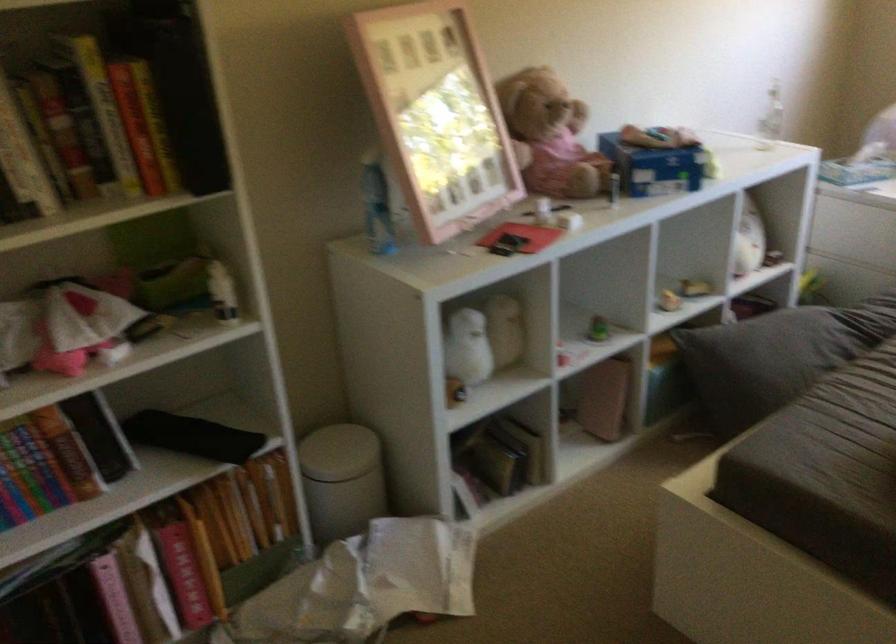
Where would you lift the brown teddy bear? Please return your answer as a coordinate pair (x, y).

(549, 136)